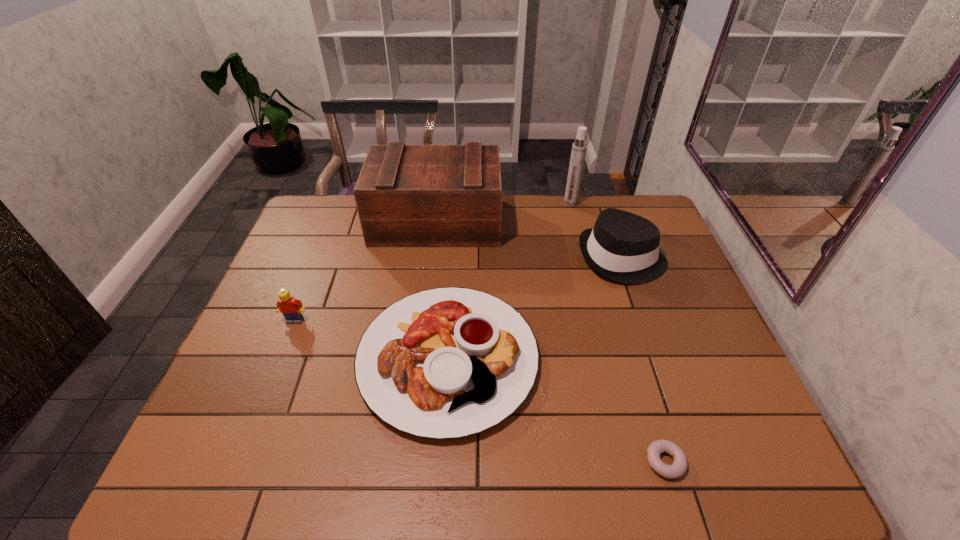
Locate an element on the screen. object located at the far right corner is located at coordinates (622, 246).

Identify the location of free location at the far edge of the desktop. (556, 215).

Where is `free space at the left edge of the desktop`? free space at the left edge of the desktop is located at coordinates (245, 382).

Identify the location of blank space at the right edge of the desktop. Image resolution: width=960 pixels, height=540 pixels. (732, 376).

Locate an element on the screen. This screenshot has height=540, width=960. vacant region at the far left corner of the desktop is located at coordinates (315, 212).

Identify the location of vacant point located between the doughnut and the fedora. This screenshot has height=540, width=960. (643, 360).

You are a GUI agent. You are given a task and a screenshot of the screen. Output one action in this format:
    pyautogui.click(x=<x>, y=<y>)
    Task: Click on the vacant space in between the box and the third tallest object
    This screenshot has width=960, height=540.
    Given the screenshot: What is the action you would take?
    pyautogui.click(x=529, y=240)

Find the location of a particular element. The height and width of the screenshot is (540, 960). free point between the fifth tallest object and the doughnut is located at coordinates click(x=557, y=410).

Find the location of a particular element. Image resolution: width=960 pixels, height=540 pixels. vacant area that lies between the second shortest object and the tallest object is located at coordinates pos(509,281).

This screenshot has height=540, width=960. Identify the location of free area in between the shortest object and the fedora. (643, 360).